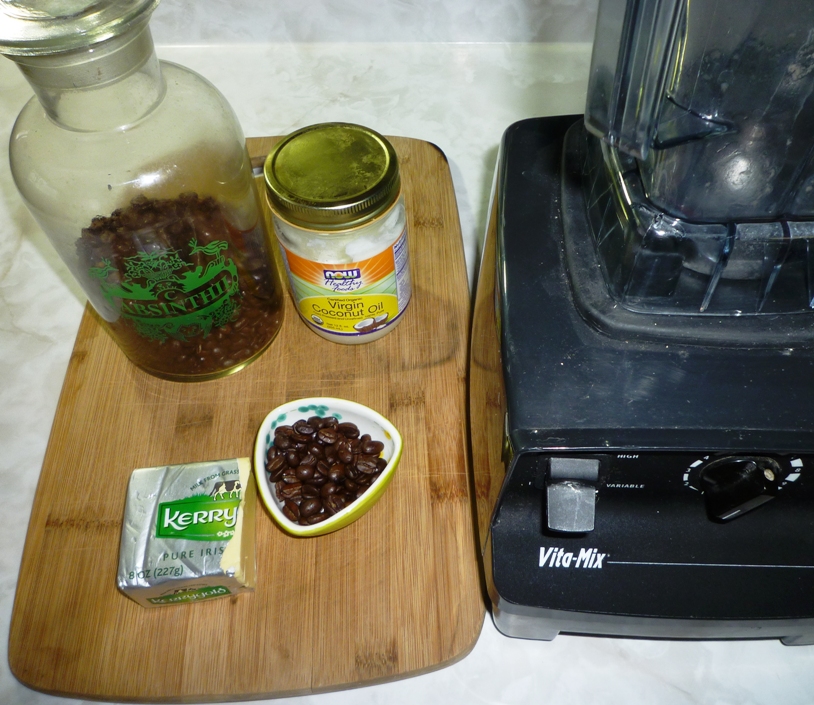
The image size is (814, 705). I want to click on jar, so click(154, 255).